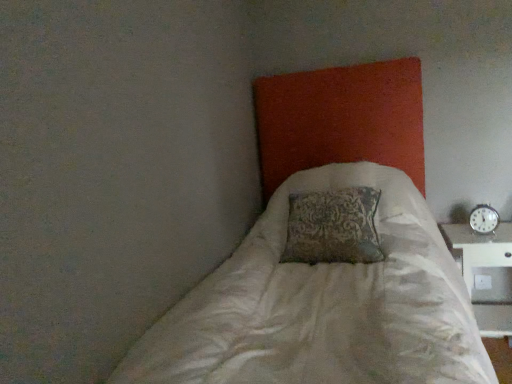
Image resolution: width=512 pixels, height=384 pixels. Identify the location of white plastic table at right. (485, 273).

What is the approximate height of white textured bed at center?

The height of white textured bed at center is 1.62 meters.

Measure the distance between white textured bed at center and camera.

A distance of 7.35 feet exists between white textured bed at center and camera.

What are the coordinates of `white plastic table at right` in the screenshot? It's located at (485, 273).

Looking at this image, is white textured bed at center inside metallic silver clock at right?

No, white textured bed at center is not inside metallic silver clock at right.

From a real-world perspective, is metallic silver clock at right positioned above or below white textured bed at center?

In terms of real-world spatial position, metallic silver clock at right is below white textured bed at center.

Between metallic silver clock at right and white textured bed at center, which one has larger width?

With larger width is white textured bed at center.

You are a GUI agent. You are given a task and a screenshot of the screen. Output one action in this format:
    pyautogui.click(x=<x>, y=<y>)
    Task: Click on the clock on the right of white textured bed at center
    
    Given the screenshot: What is the action you would take?
    pyautogui.click(x=484, y=219)

How distant is metallic silver clock at right from white plastic table at right?

metallic silver clock at right and white plastic table at right are 29.98 centimeters apart from each other.

Could you tell me if metallic silver clock at right is turned towards white plastic table at right?

No, metallic silver clock at right is not oriented towards white plastic table at right.

From a real-world perspective, is metallic silver clock at right positioned under white plastic table at right based on gravity?

No, from a real-world perspective, metallic silver clock at right is not below white plastic table at right.

Considering the relative sizes of metallic silver clock at right and white plastic table at right in the image provided, is metallic silver clock at right shorter than white plastic table at right?

Correct, metallic silver clock at right is not as tall as white plastic table at right.

How distant is white textured bed at center from metallic silver clock at right?

The distance of white textured bed at center from metallic silver clock at right is 71.16 centimeters.

Consider the image. Is the depth of white textured bed at center greater than that of metallic silver clock at right?

No, white textured bed at center is in front of metallic silver clock at right.

From a real-world perspective, is white textured bed at center physically located above or below metallic silver clock at right?

In terms of real-world spatial position, white textured bed at center is above metallic silver clock at right.

What's the angular difference between white textured bed at center and white plastic table at right's facing directions?

white textured bed at center and white plastic table at right are facing 0.000367 degrees away from each other.

Find the location of a particular element. bed in front of the white plastic table at right is located at coordinates pos(340,120).

Is white textured bed at center looking in the opposite direction of white plastic table at right?

No, white textured bed at center is not facing the opposite direction of white plastic table at right.

Which of these two, white textured bed at center or white plastic table at right, is bigger?

white textured bed at center is bigger.

I want to click on table in front of the metallic silver clock at right, so click(x=485, y=273).

How much distance is there between white plastic table at right and metallic silver clock at right?

They are 29.98 centimeters apart.

Considering the positions of points (481, 283) and (471, 224), is point (481, 283) farther from camera compared to point (471, 224)?

Yes, point (481, 283) is farther from viewer.

From the image's perspective, is white plastic table at right on top of metallic silver clock at right?

Actually, white plastic table at right appears below metallic silver clock at right in the image.

Locate an element on the screen. This screenshot has height=384, width=512. table behind the white textured bed at center is located at coordinates (485, 273).

Is white plastic table at right positioned beyond the bounds of white textured bed at center?

Yes.

Is white plastic table at right at the right side of white textured bed at center?

Correct, you'll find white plastic table at right to the right of white textured bed at center.

In terms of size, does white plastic table at right appear bigger or smaller than white textured bed at center?

Considering their sizes, white plastic table at right takes up less space than white textured bed at center.

The height and width of the screenshot is (384, 512). Find the location of `clock that appears below the white textured bed at center (from a real-world perspective)`. clock that appears below the white textured bed at center (from a real-world perspective) is located at coordinates (484, 219).

Locate an element on the screen. This screenshot has width=512, height=384. table on the right of metallic silver clock at right is located at coordinates (485, 273).

From the image, which object appears to be nearer to white plastic table at right, white textured bed at center or metallic silver clock at right?

metallic silver clock at right is positioned closer to the anchor white plastic table at right.

Which object lies nearer to the anchor point metallic silver clock at right, white plastic table at right or white textured bed at center?

white plastic table at right lies closer to metallic silver clock at right than the other object.

From the picture: Looking at the image, which one is located closer to metallic silver clock at right, white textured bed at center or white plastic table at right?

white plastic table at right is positioned closer to the anchor metallic silver clock at right.

From the image, which object appears to be nearer to white plastic table at right, metallic silver clock at right or white textured bed at center?

metallic silver clock at right.

Looking at the image, which one is located closer to white textured bed at center, white plastic table at right or metallic silver clock at right?

white plastic table at right is positioned closer to the anchor white textured bed at center.

From the picture: Based on their spatial positions, is metallic silver clock at right or white plastic table at right further from white textured bed at center?

metallic silver clock at right lies further to white textured bed at center than the other object.

Identify the location of table between white textured bed at center and metallic silver clock at right from front to back. The height and width of the screenshot is (384, 512). (485, 273).